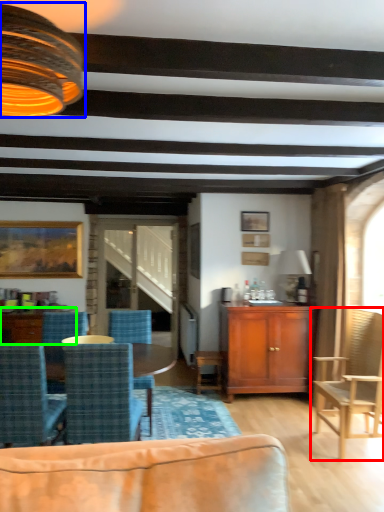
Question: Which object is the closest to the chair (highlighted by a red box)? Choose among these: lamp (highlighted by a blue box) or coffee table (highlighted by a green box).

Choices:
 (A) lamp
 (B) coffee table

Answer: (B)